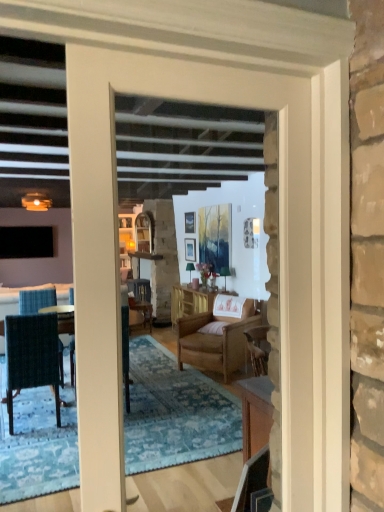
Question: Which is correct: wooden cabinet at center is inside white wood door at center, or outside of it?

Choices:
 (A) inside
 (B) outside

Answer: (B)

Question: Does point (188, 306) appear closer or farther from the camera than point (114, 399)?

Choices:
 (A) farther
 (B) closer

Answer: (A)

Question: Considering the real-world distances, which object is farthest from the wooden cabinet at center?

Choices:
 (A) wooden picture frame at upper center, which is the second picture frame in bottom-to-top order
 (B) white wood door at center
 (C) wooden chair at center, which appears as the 3th chair when viewed from the front
 (D) matte gold lamp at upper left
 (E) wooden armchair at center, acting as the second chair starting from the front

Answer: (B)

Question: Estimate the real-world distances between objects in this image. Which object is farther from the matte gold lamp at upper left?

Choices:
 (A) light pink fabric pillow at center
 (B) wooden chair at center, which appears as the 3th chair when viewed from the front
 (C) dark blue woven chair at left, which ranks as the 1th chair in left-to-right order
 (D) white wood door at center
 (E) wooden picture frame at upper center, which is the second picture frame in bottom-to-top order

Answer: (D)